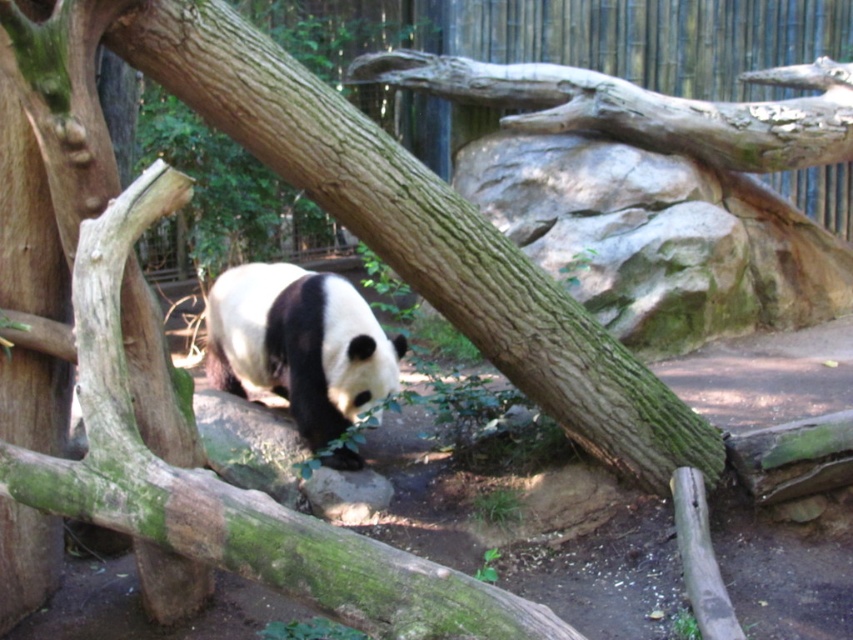
Can you confirm if smooth brown branch at upper center is taller than black fuzzy panda at center?

Incorrect, smooth brown branch at upper center's height is not larger of black fuzzy panda at center's.

Between point (628, 140) and point (207, 337), which one is positioned behind?

Positioned behind is point (628, 140).

Between point (639, 92) and point (264, 317), which one is positioned behind?

The point (639, 92) is more distant.

Locate an element on the screen. smooth brown branch at upper center is located at coordinates (643, 108).